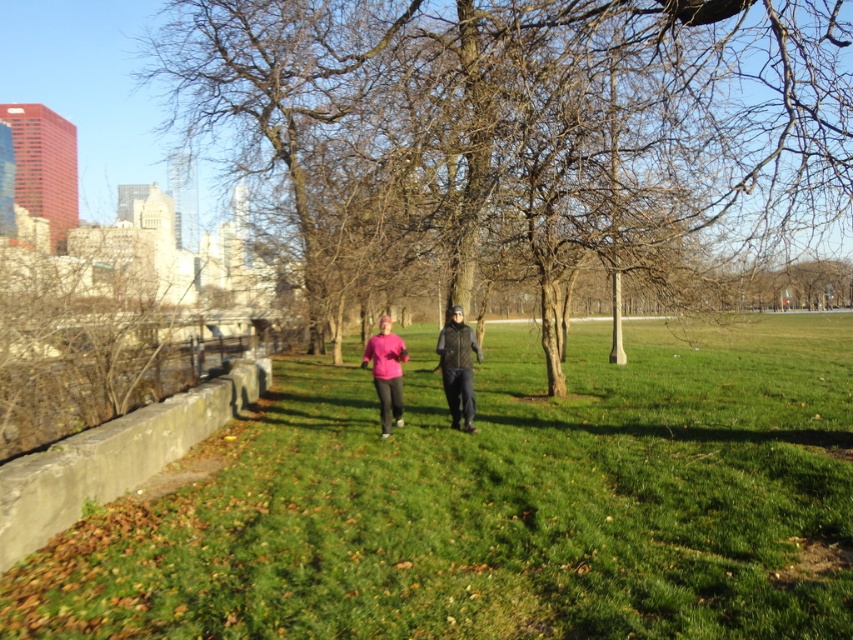
You are standing at the point with coordinates point (450, 406) and want to walk towards the point (733, 460). Given the scene described, will you need to cross any obstacles like the concrete barrier or the water body?

The point (733, 460) is in front of point (450, 406), so you would not need to cross any obstacles like the concrete barrier or the water body to reach it.

You are an observer standing on the path in the scene. You notice two people wearing the dark green quilted vest at center and the pink matte shirt at center. Which of these two items of clothing appears to be smaller in size?

The dark green quilted vest at center is smaller than the pink matte shirt at center, so the dark green quilted vest at center appears to be the smaller one.